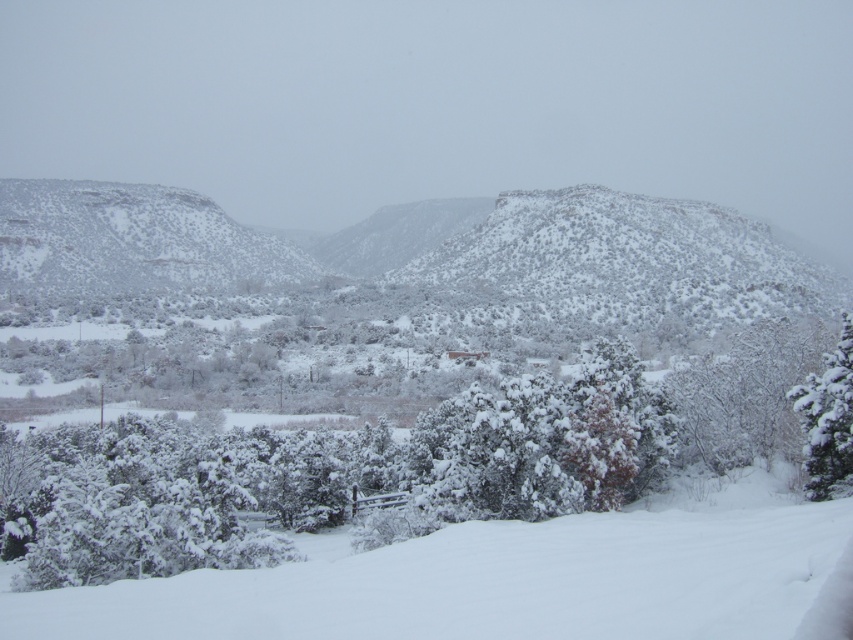
Does snow-covered rock at left have a smaller size compared to white fluffy snow at center?

Incorrect, snow-covered rock at left is not smaller in size than white fluffy snow at center.

Is point (477, 304) positioned behind point (505, 474)?

That is True.

Locate an element on the screen. snow-covered rock at left is located at coordinates (366, 294).

Can you confirm if snow-covered rock at left is positioned to the left of white snow ski slope at lower center?

Incorrect, snow-covered rock at left is not on the left side of white snow ski slope at lower center.

Which is more to the right, snow-covered rock at left or white snow ski slope at lower center?

snow-covered rock at left

What do you see at coordinates (366, 294) in the screenshot? The image size is (853, 640). I see `snow-covered rock at left` at bounding box center [366, 294].

I want to click on snow-covered rock at left, so click(x=366, y=294).

Who is lower down, white snow ski slope at lower center or white fluffy snow at right?

Positioned lower is white snow ski slope at lower center.

Consider the image. Is white snow ski slope at lower center further to camera compared to white fluffy snow at right?

No, white snow ski slope at lower center is in front of white fluffy snow at right.

What do you see at coordinates (486, 582) in the screenshot? I see `white snow ski slope at lower center` at bounding box center [486, 582].

The height and width of the screenshot is (640, 853). What are the coordinates of `white snow ski slope at lower center` in the screenshot? It's located at (486, 582).